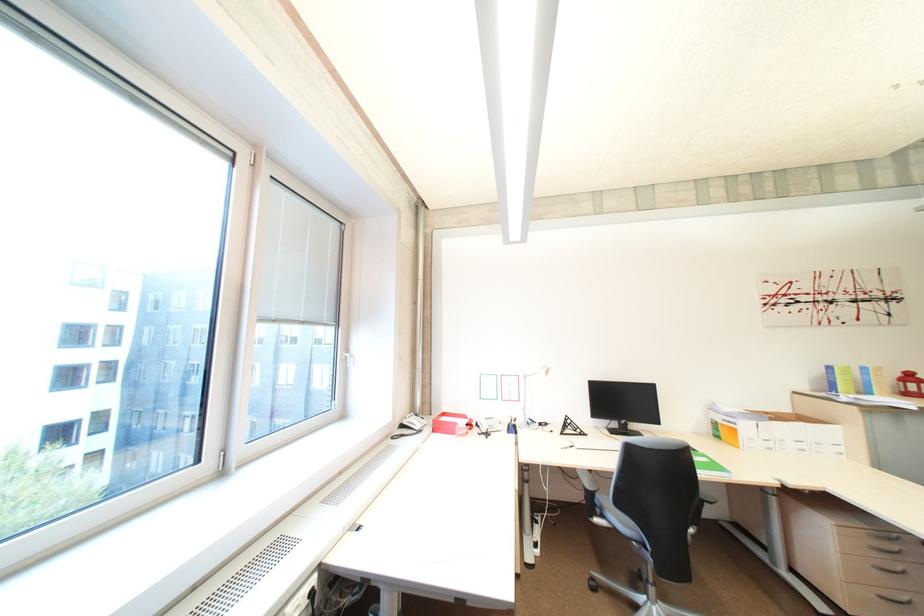
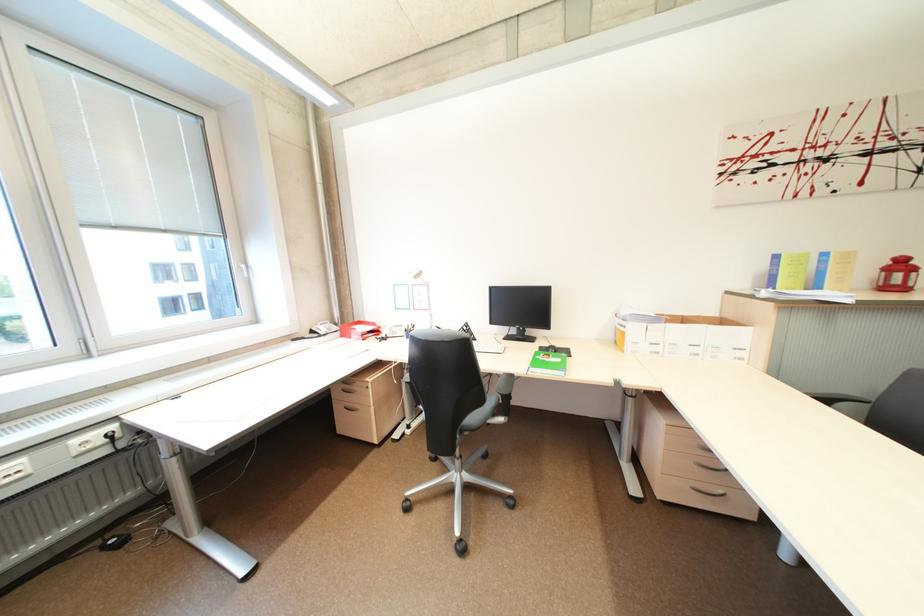
Question: What movement of the cameraman would produce the second image?

Choices:
 (A) Left
 (B) Right
 (C) Forward
 (D) Backward

Answer: (B)